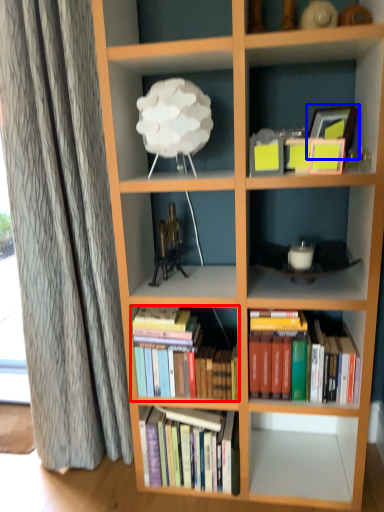
Question: Which object is closer to the camera taking this photo, book (highlighted by a red box) or picture frame (highlighted by a blue box)?

Choices:
 (A) book
 (B) picture frame

Answer: (B)